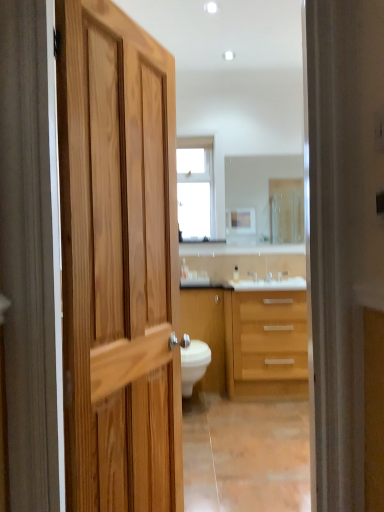
The height and width of the screenshot is (512, 384). What do you see at coordinates (195, 187) in the screenshot?
I see `clear glass window at upper center` at bounding box center [195, 187].

Image resolution: width=384 pixels, height=512 pixels. What do you see at coordinates (206, 332) in the screenshot?
I see `matte wood cabinet at center` at bounding box center [206, 332].

Where is `clear glass mirror at center`? This screenshot has width=384, height=512. clear glass mirror at center is located at coordinates (257, 183).

The height and width of the screenshot is (512, 384). What do you see at coordinates (253, 276) in the screenshot?
I see `satin nickel faucet at center` at bounding box center [253, 276].

You are a GUI agent. You are given a task and a screenshot of the screen. Output one action in this format:
    pyautogui.click(x=<x>, y=<y>)
    Task: Click on the clear glass window at upper center
    The image size is (384, 512).
    Given the screenshot: What is the action you would take?
    pyautogui.click(x=195, y=187)

What's the angular difference between clear glass window at upper center and satin nickel faucet at center's facing directions?

0.397 degrees.

Is clear glass window at upper center beside satin nickel faucet at center?

Answer: clear glass window at upper center is not next to satin nickel faucet at center, and they're not touching.

In the image, is clear glass window at upper center on the left side or the right side of satin nickel faucet at center?

From the image, it's evident that clear glass window at upper center is to the left of satin nickel faucet at center.

Is clear glass mirror at center at the back of matte wood cabinet at center?

No, clear glass mirror at center is not at the back of matte wood cabinet at center.

Is matte wood cabinet at center positioned far away from clear glass mirror at center?

No, matte wood cabinet at center is not far away from clear glass mirror at center.

Locate an element on the screen. This screenshot has width=384, height=512. cabinetry below the clear glass mirror at center (from the image's perspective) is located at coordinates (206, 332).

Does matte wood cabinet at center appear on the left side of clear glass mirror at center?

Correct, you'll find matte wood cabinet at center to the left of clear glass mirror at center.

Is point (181, 232) farther from viewer compared to point (246, 195)?

Yes.

Can you confirm if clear glass window at upper center is shorter than clear glass mirror at center?

In fact, clear glass window at upper center may be taller than clear glass mirror at center.

From the picture: Is clear glass window at upper center to the left of clear glass mirror at center from the viewer's perspective?

Yes, clear glass window at upper center is to the left of clear glass mirror at center.

From the image's perspective, is clear glass window at upper center located above or below light wood cabinet at center?

Clearly, from the image's perspective, clear glass window at upper center is above light wood cabinet at center.

How many degrees apart are the facing directions of clear glass window at upper center and light wood cabinet at center?

0.576 degrees.

Visually, is clear glass window at upper center positioned to the left or to the right of light wood cabinet at center?

clear glass window at upper center is positioned on light wood cabinet at center's left side.

Is point (198, 185) positioned in front of point (202, 297)?

That is False.

Is clear glass mirror at center smaller than clear glass window at upper center?

Indeed, clear glass mirror at center has a smaller size compared to clear glass window at upper center.

In terms of height, does clear glass mirror at center look taller or shorter compared to clear glass window at upper center?

Clearly, clear glass mirror at center is shorter compared to clear glass window at upper center.

Are clear glass mirror at center and clear glass window at upper center far apart?

clear glass mirror at center is near clear glass window at upper center, not far away.

Between clear glass mirror at center and clear glass window at upper center, which one appears on the left side from the viewer's perspective?

clear glass window at upper center.

Considering the positions of objects matte wood cabinet at center and satin nickel faucet at center in the image provided, who is in front, matte wood cabinet at center or satin nickel faucet at center?

matte wood cabinet at center is in front.

Would you say matte wood cabinet at center is a long distance from satin nickel faucet at center?

No.

Is matte wood cabinet at center aimed at satin nickel faucet at center?

No.

From the image's perspective, is matte wood cabinet at center positioned above or below satin nickel faucet at center?

matte wood cabinet at center is below satin nickel faucet at center.

Is matte wood cabinet at center oriented away from light wood cabinet at center?

matte wood cabinet at center is not turned away from light wood cabinet at center.

Does point (218, 348) come behind point (291, 393)?

That is True.

Identify the location of window on the left of satin nickel faucet at center. (195, 187).

Identify the location of mirror behind the matte wood cabinet at center. This screenshot has width=384, height=512. (257, 183).

Looking at the image, which one is located closer to light wood cabinet at center, satin nickel faucet at center or matte wood cabinet at center?

The object closer to light wood cabinet at center is matte wood cabinet at center.

Based on their spatial positions, is matte wood cabinet at center or clear glass window at upper center closer to clear glass mirror at center?

Among the two, clear glass window at upper center is located nearer to clear glass mirror at center.

Considering their positions, is light wood cabinet at center positioned closer to clear glass window at upper center than matte wood cabinet at center?

Based on the image, matte wood cabinet at center appears to be nearer to clear glass window at upper center.

Considering their positions, is clear glass window at upper center positioned further to satin nickel faucet at center than light wood cabinet at center?

Among the two, clear glass window at upper center is located further to satin nickel faucet at center.

When comparing their distances from clear glass window at upper center, does light wood cabinet at center or clear glass mirror at center seem further?

light wood cabinet at center lies further to clear glass window at upper center than the other object.

From the image, which object appears to be farther from clear glass window at upper center, clear glass mirror at center or satin nickel faucet at center?

satin nickel faucet at center is further to clear glass window at upper center.

Which object lies nearer to the anchor point clear glass mirror at center, satin nickel faucet at center or light wood cabinet at center?

satin nickel faucet at center is positioned closer to the anchor clear glass mirror at center.

When comparing their distances from clear glass window at upper center, does satin nickel faucet at center or light wood cabinet at center seem closer?

satin nickel faucet at center is closer to clear glass window at upper center.

Identify the location of mirror between clear glass window at upper center and light wood cabinet at center from top to bottom. This screenshot has width=384, height=512. 257,183.

Image resolution: width=384 pixels, height=512 pixels. I want to click on bathroom cabinet between clear glass mirror at center and matte wood cabinet at center from top to bottom, so click(250, 340).

What are the coordinates of `faucet between clear glass window at upper center and matte wood cabinet at center in the up-down direction` in the screenshot? It's located at click(x=253, y=276).

Where is `bathroom cabinet between clear glass window at upper center and matte wood cabinet at center in the up-down direction`? The image size is (384, 512). bathroom cabinet between clear glass window at upper center and matte wood cabinet at center in the up-down direction is located at coordinates (250, 340).